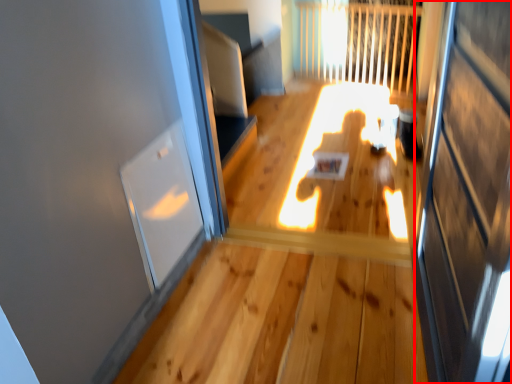
Question: Considering the relative positions of screen door (annotated by the red box) and window in the image provided, where is screen door (annotated by the red box) located with respect to the staircase?

Choices:
 (A) right
 (B) left

Answer: (A)